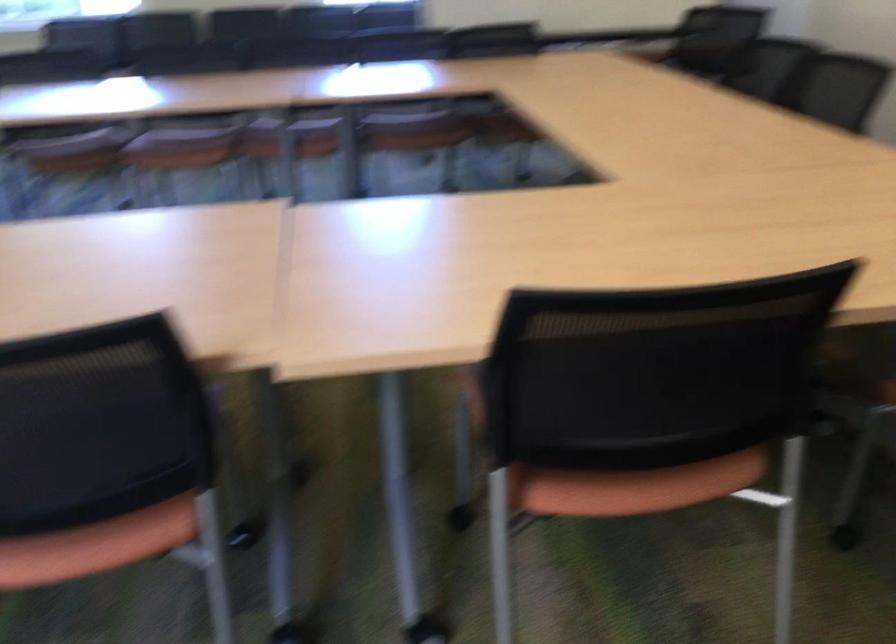
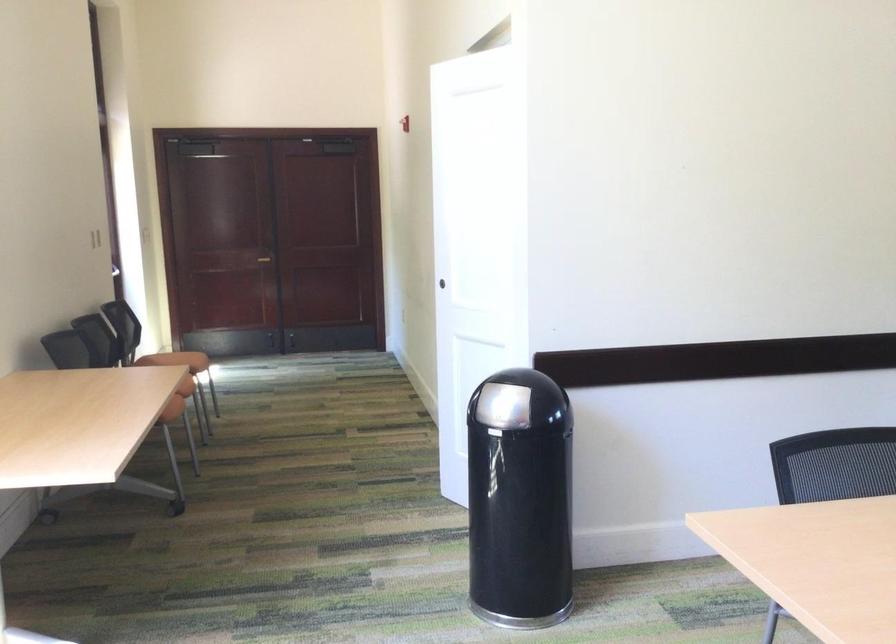
Question: The camera is either moving clockwise (left) or counter-clockwise (right) around the object. The first image is from the beginning of the video and the second image is from the end. Is the camera moving left or right when shooting the video?

Choices:
 (A) Left
 (B) Right

Answer: (B)